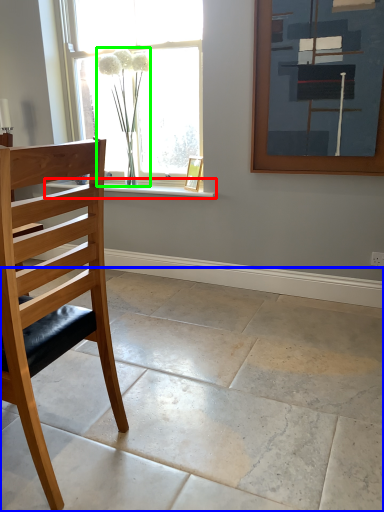
Question: Considering the real-world distances, which object is closest to window sill (highlighted by a red box)? concrete (highlighted by a blue box) or plant (highlighted by a green box).

Choices:
 (A) concrete
 (B) plant

Answer: (B)